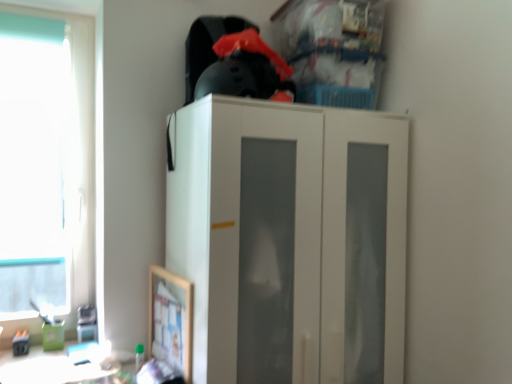
The height and width of the screenshot is (384, 512). What do you see at coordinates (79, 145) in the screenshot? I see `transparent glass window at left` at bounding box center [79, 145].

Find the location of a particular element. transparent glass window at left is located at coordinates (79, 145).

Locate an element on the screen. This screenshot has height=384, width=512. white matte cabinet at center is located at coordinates (290, 241).

The image size is (512, 384). What do you see at coordinates (290, 241) in the screenshot? I see `white matte cabinet at center` at bounding box center [290, 241].

Image resolution: width=512 pixels, height=384 pixels. I want to click on transparent glass window at left, so click(x=79, y=145).

Can you confirm if white matte cabinet at center is positioned to the left of transparent glass window at left?

Incorrect, white matte cabinet at center is not on the left side of transparent glass window at left.

Does white matte cabinet at center come behind transparent glass window at left?

No, it is in front of transparent glass window at left.

Is point (258, 367) more distant than point (73, 237)?

That is False.

From the image's perspective, is white matte cabinet at center located above or below transparent glass window at left?

white matte cabinet at center is situated lower than transparent glass window at left in the image.

From a real-world perspective, is white matte cabinet at center physically located above or below transparent glass window at left?

white matte cabinet at center is below transparent glass window at left.

Between white matte cabinet at center and transparent glass window at left, which one has larger width?

white matte cabinet at center.

Which of these two, white matte cabinet at center or transparent glass window at left, stands shorter?

white matte cabinet at center is shorter.

Does white matte cabinet at center have a larger size compared to transparent glass window at left?

Yes.

Is white matte cabinet at center spatially inside transparent glass window at left, or outside of it?

white matte cabinet at center lies outside transparent glass window at left.

Is the surface of white matte cabinet at center in direct contact with transparent glass window at left?

white matte cabinet at center and transparent glass window at left are not in contact.

Could you tell me if white matte cabinet at center is facing transparent glass window at left?

No, white matte cabinet at center is not facing towards transparent glass window at left.

What's the angular difference between white matte cabinet at center and transparent glass window at left's facing directions?

They differ by 0.501 degrees in their facing directions.

How far apart are white matte cabinet at center and transparent glass window at left?

The distance of white matte cabinet at center from transparent glass window at left is 37.94 inches.

There is a white matte cabinet at center. Where is `window above it (from a real-world perspective)`? This screenshot has width=512, height=384. window above it (from a real-world perspective) is located at coordinates (79, 145).

Can you confirm if transparent glass window at left is positioned to the left of white matte cabinet at center?

Yes, transparent glass window at left is to the left of white matte cabinet at center.

In the scene shown: Is transparent glass window at left further to the viewer compared to white matte cabinet at center?

Yes, the depth of transparent glass window at left is greater than that of white matte cabinet at center.

Between point (75, 41) and point (294, 124), which one is positioned in front?

The point (294, 124) is more forward.

From the image's perspective, which is above, transparent glass window at left or white matte cabinet at center?

transparent glass window at left.

From a real-world perspective, is transparent glass window at left below white matte cabinet at center?

No, from a real-world perspective, transparent glass window at left is not beneath white matte cabinet at center.

Looking at their sizes, would you say transparent glass window at left is wider or thinner than white matte cabinet at center?

Considering their sizes, transparent glass window at left looks slimmer than white matte cabinet at center.

Who is shorter, transparent glass window at left or white matte cabinet at center?

white matte cabinet at center is shorter.

Can you confirm if transparent glass window at left is bigger than white matte cabinet at center?

No, transparent glass window at left is not bigger than white matte cabinet at center.

Is white matte cabinet at center located within transparent glass window at left?

No, transparent glass window at left does not contain white matte cabinet at center.

Would you consider transparent glass window at left to be distant from white matte cabinet at center?

transparent glass window at left is actually quite close to white matte cabinet at center.

Is transparent glass window at left facing towards white matte cabinet at center?

No, transparent glass window at left is not aimed at white matte cabinet at center.

Locate an element on the screen. cupboard lying in front of the transparent glass window at left is located at coordinates (290, 241).

This screenshot has height=384, width=512. Identify the location of window on the left of white matte cabinet at center. (79, 145).

You are a GUI agent. You are given a task and a screenshot of the screen. Output one action in this format:
    pyautogui.click(x=<x>, y=<y>)
    Task: Click on the cupboard that is in front of the transparent glass window at left
    The image size is (512, 384).
    Given the screenshot: What is the action you would take?
    290,241